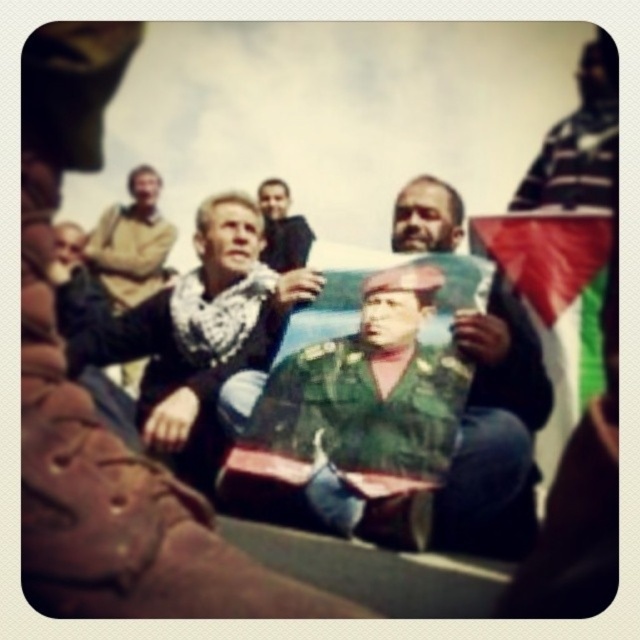
Can you confirm if camouflage uniform at center is taller than green fabric flag at center?

Yes, camouflage uniform at center is taller than green fabric flag at center.

What are the coordinates of `camouflage uniform at center` in the screenshot? It's located at (192, 332).

Who is more distant from viewer, (x=163, y=401) or (x=561, y=340)?

Point (x=163, y=401)

Locate an element on the screen. camouflage uniform at center is located at coordinates (192, 332).

Is camouflage uniform at center bigger than light brown leather jacket at upper left?

Indeed, camouflage uniform at center has a larger size compared to light brown leather jacket at upper left.

Which is behind, point (104, 348) or point (125, 221)?

The point (125, 221) is behind.

The image size is (640, 640). I want to click on camouflage uniform at center, so click(192, 332).

This screenshot has width=640, height=640. Identify the location of camouflage uniform at center. (192, 332).

Based on the photo, is green military uniform at center below green fabric flag at center?

Yes, green military uniform at center is below green fabric flag at center.

I want to click on green military uniform at center, so click(497, 432).